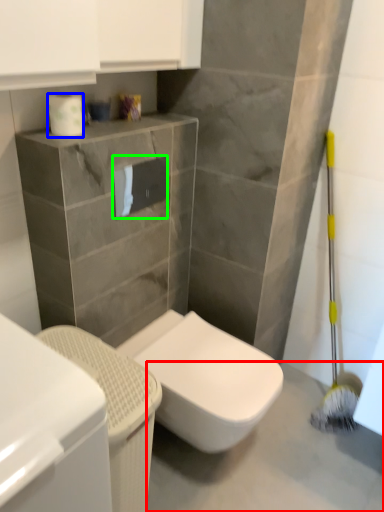
Question: Estimate the real-world distances between objects in this image. Which object is farther from concrete (highlighted by a red box), toilet paper (highlighted by a blue box) or toilet paper (highlighted by a green box)?

Choices:
 (A) toilet paper
 (B) toilet paper

Answer: (A)